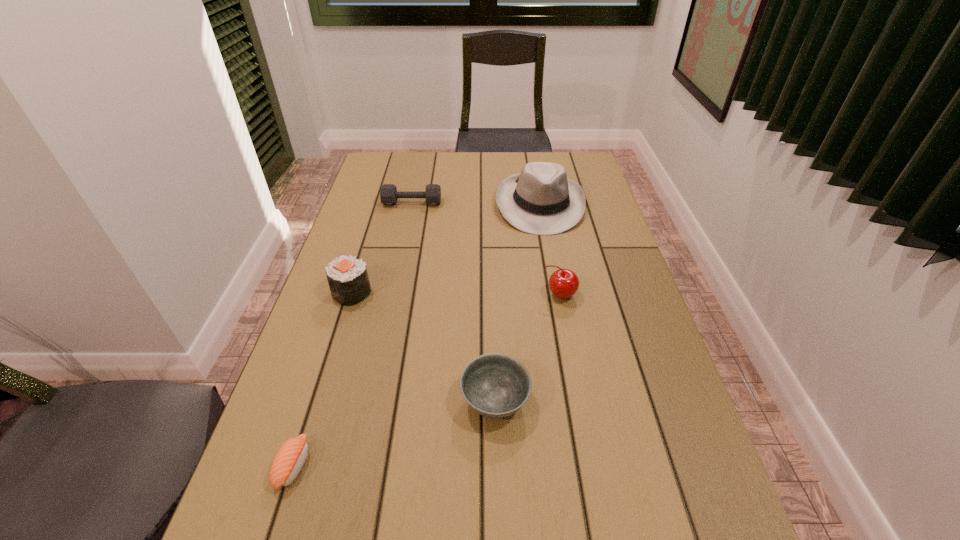
The height and width of the screenshot is (540, 960). I want to click on vacant space in between the fedora and the farther sushi, so click(x=445, y=248).

What are the coordinates of `object that is the fifth closest one to the farther sushi` in the screenshot? It's located at (563, 283).

Locate an element on the screen. The width and height of the screenshot is (960, 540). object that is the second closest to the farther sushi is located at coordinates (388, 192).

Locate which sushi ranks in proximity to the dumbbell. Please provide its 2D coordinates. Your answer should be formatted as a tuple, i.e. [(x, y)], where the tuple contains the x and y coordinates of a point satisfying the conditions above.

[(348, 279)]

Identify the location of sushi identified as the closest to the dumbbell. (348, 279).

This screenshot has width=960, height=540. I want to click on free space that satisfies the following two spatial constraints: 1. on the back side of the bowl; 2. on the left side of the nearer sushi, so click(x=314, y=401).

This screenshot has height=540, width=960. I want to click on free space that satisfies the following two spatial constraints: 1. on the back side of the farther sushi; 2. on the left side of the dumbbell, so click(379, 203).